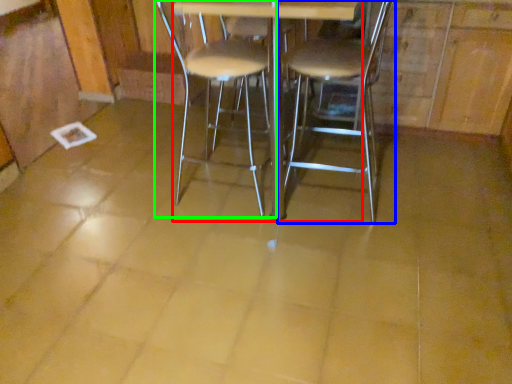
Question: Which object is the closest to the round table (highlighted by a red box)? Choose among these: chair (highlighted by a blue box) or chair (highlighted by a green box).

Choices:
 (A) chair
 (B) chair

Answer: (A)